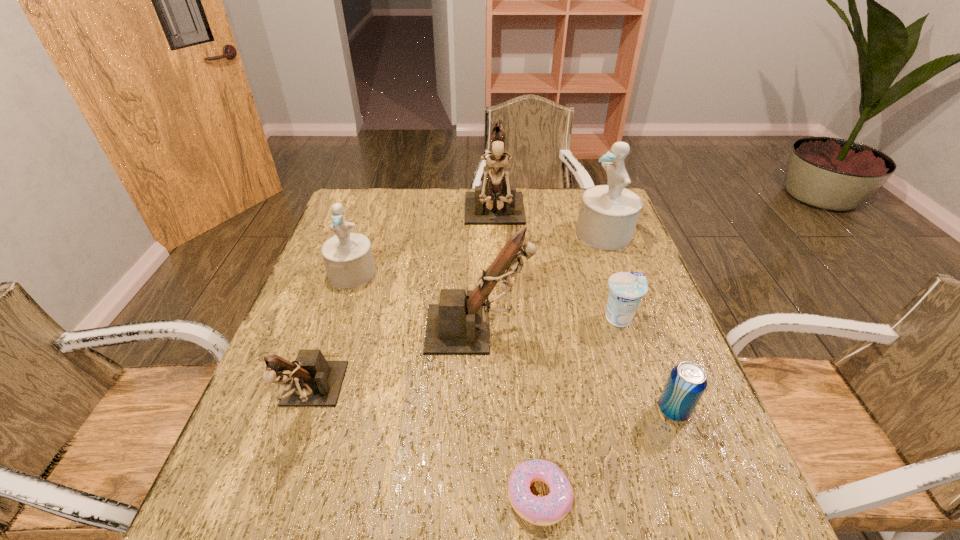
Identify the location of beer can. (687, 381).

Locate an element on the screen. yogurt is located at coordinates point(626,290).

I want to click on doughnut, so click(x=548, y=510).

Find the location of `pink doughnut`. pink doughnut is located at coordinates (548, 510).

This screenshot has width=960, height=540. I want to click on vacant region located 0.290m on the front-facing side of the farthest brown figurine, so click(499, 319).

You are a GUI agent. You are given a task and a screenshot of the screen. Output one action in this format:
    pyautogui.click(x=<x>, y=<y>)
    Task: Click on the free space located at the beak of the farther white figurine
    The width and height of the screenshot is (960, 540).
    Given the screenshot: What is the action you would take?
    pyautogui.click(x=492, y=234)

Identify the location of vacant space situated 0.360m at the beak of the farther white figurine. (459, 234).

The image size is (960, 540). What are the coordinates of `blank space located at the beak of the farther white figurine` in the screenshot? It's located at pos(531,234).

Where is `vacant space situated on the front-facing side of the second smallest brown figurine`? The height and width of the screenshot is (540, 960). vacant space situated on the front-facing side of the second smallest brown figurine is located at coordinates (595, 329).

You are a GUI agent. You are given a task and a screenshot of the screen. Output one action in this format:
    pyautogui.click(x=<x>, y=<y>)
    Task: Click on the vacant area located at the beak of the smaller white figurine
    This screenshot has width=960, height=540.
    Given the screenshot: What is the action you would take?
    pyautogui.click(x=340, y=310)